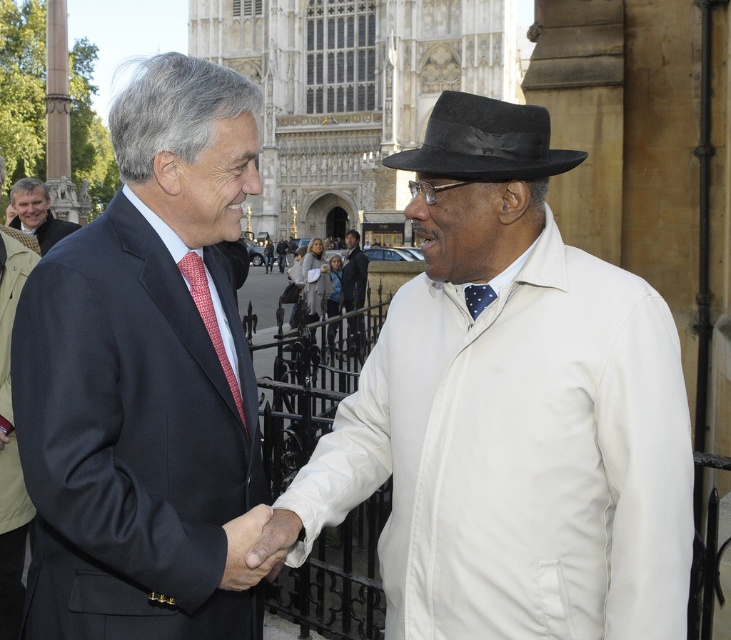
You are a photographer setting up for an event at the historic site. You need to position a camera tripod so it doesn not block the view of the matte black suit at upper left and the black felt fedora at center. Based on their positions, which object is closer to the camera, requiring the tripod to be placed further back to avoid obstruction?

The black felt fedora at center is closer to the camera than the matte black suit at upper left, so the tripod should be placed further back to avoid blocking the view of the fedora.

You are a photographer trying to capture a portrait of both the white matte jacket at center and the matte black suit at center during their handshake. Since you want both subjects to appear balanced in the frame, which subject should you position lower in the camera viewfinder to compensate for their actual heights?

The white matte jacket at center is shorter than the matte black suit at center. To balance their appearances in the frame, position the white matte jacket at center lower in the camera viewfinder so that it visually aligns with the height of the matte black suit at center.